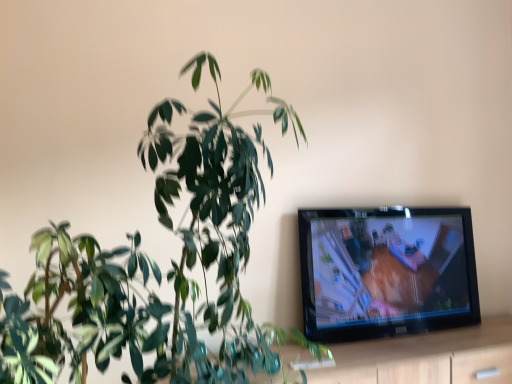
Find the location of a particular element. This screenshot has width=512, height=384. green glossy plant at left is located at coordinates (156, 263).

This screenshot has width=512, height=384. Describe the element at coordinates (156, 263) in the screenshot. I see `green glossy plant at left` at that location.

Locate an element on the screen. light wood dresser at lower right is located at coordinates (425, 357).

In order to face light wood dresser at lower right, should I rotate leftwards or rightwards?

A 21.016 degree turn to the right will do.

What do you see at coordinates (425, 357) in the screenshot?
I see `light wood dresser at lower right` at bounding box center [425, 357].

At what (x,y) coordinates should I click in order to perform the action: click on green glossy plant at left. Please return your answer as a coordinate pair (x, y). Looking at the image, I should click on (156, 263).

Considering the positions of objects light wood dresser at lower right and green glossy plant at left in the image provided, who is more to the left, light wood dresser at lower right or green glossy plant at left?

Positioned to the left is green glossy plant at left.

Between light wood dresser at lower right and green glossy plant at left, which one is positioned in front?

green glossy plant at left.

Is point (510, 378) closer or farther from the camera than point (247, 89)?

Clearly, point (510, 378) is closer to the camera than point (247, 89).

From the image's perspective, relative to green glossy plant at left, is light wood dresser at lower right above or below?

light wood dresser at lower right is below green glossy plant at left.

From a real-world perspective, is light wood dresser at lower right beneath green glossy plant at left?

Indeed, from a real-world perspective, light wood dresser at lower right is positioned beneath green glossy plant at left.

Looking at this image, between light wood dresser at lower right and green glossy plant at left, which one has larger width?

green glossy plant at left.

Can you confirm if light wood dresser at lower right is taller than green glossy plant at left?

Incorrect, the height of light wood dresser at lower right is not larger of that of green glossy plant at left.

Which of these two, light wood dresser at lower right or green glossy plant at left, is bigger?

Bigger between the two is green glossy plant at left.

Could green glossy plant at left be considered to be inside light wood dresser at lower right?

No, green glossy plant at left is not surrounded by light wood dresser at lower right.

Is light wood dresser at lower right not near green glossy plant at left?

That's not correct — light wood dresser at lower right is a little close to green glossy plant at left.

Is light wood dresser at lower right facing away from green glossy plant at left?

That's not correct — light wood dresser at lower right is not looking away from green glossy plant at left.

Find the location of `dresser located behind the green glossy plant at left`. dresser located behind the green glossy plant at left is located at coordinates (425, 357).

Which object is positioned more to the right, green glossy plant at left or light wood dresser at lower right?

light wood dresser at lower right is more to the right.

Which object is closer to the camera taking this photo, green glossy plant at left or light wood dresser at lower right?

green glossy plant at left.

Which point is more forward, (218, 253) or (413, 370)?

The point (218, 253) is in front.

From the image's perspective, does green glossy plant at left appear lower than light wood dresser at lower right?

No, from the image's perspective, green glossy plant at left is not beneath light wood dresser at lower right.

From a real-world perspective, is green glossy plant at left above or below light wood dresser at lower right?

From a real-world perspective, green glossy plant at left is physically above light wood dresser at lower right.

Does green glossy plant at left have a greater width compared to light wood dresser at lower right?

Yes.

In terms of height, does green glossy plant at left look taller or shorter compared to light wood dresser at lower right?

Clearly, green glossy plant at left is taller compared to light wood dresser at lower right.

Does green glossy plant at left have a larger size compared to light wood dresser at lower right?

Yes, green glossy plant at left is bigger than light wood dresser at lower right.

Is green glossy plant at left spatially inside light wood dresser at lower right, or outside of it?

green glossy plant at left is not inside light wood dresser at lower right, it's outside.

Are green glossy plant at left and light wood dresser at lower right far apart?

No, green glossy plant at left is not far away from light wood dresser at lower right.

Is green glossy plant at left positioned with its back to light wood dresser at lower right?

green glossy plant at left is not turned away from light wood dresser at lower right.

How many degrees apart are the facing directions of green glossy plant at left and light wood dresser at lower right?

The facing directions of green glossy plant at left and light wood dresser at lower right are 1.15 degrees apart.

Locate an element on the screen. The image size is (512, 384). dresser on the right of green glossy plant at left is located at coordinates (425, 357).

Locate an element on the screen. The width and height of the screenshot is (512, 384). houseplant above the light wood dresser at lower right (from the image's perspective) is located at coordinates (156, 263).

The image size is (512, 384). What are the coordinates of `dresser located behind the green glossy plant at left` in the screenshot? It's located at (425, 357).